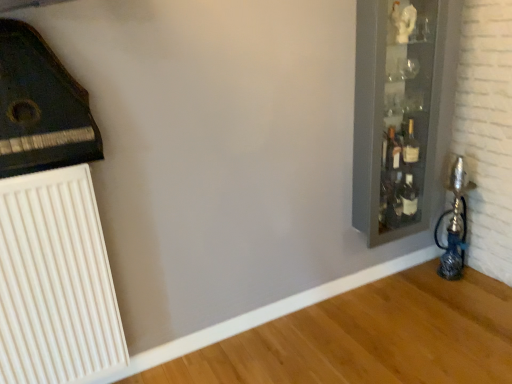
Measure the distance between point (389, 160) and camera.

The distance of point (389, 160) from camera is 6.98 feet.

The height and width of the screenshot is (384, 512). What do you see at coordinates (393, 151) in the screenshot? I see `translucent glass bottle at right` at bounding box center [393, 151].

The image size is (512, 384). I want to click on white plastic radiator at lower left, so pos(55,281).

Image resolution: width=512 pixels, height=384 pixels. What are the coordinates of `bottle below the clear glass cabinet at right (from the image's perspective)` in the screenshot? It's located at (393, 151).

Can you confirm if clear glass cabinet at right is taller than translucent glass bottle at right?

Yes.

From the image's perspective, between clear glass cabinet at right and translucent glass bottle at right, who is located below?

translucent glass bottle at right.

Would you say translucent glass bottle at right contains clear glass cabinet at right?

No, translucent glass bottle at right does not contain clear glass cabinet at right.

Between translucent glass bottle at right and clear glass cabinet at right, which one has larger size?

clear glass cabinet at right.

From the image's perspective, is translucent glass bottle at right located above or below clear glass cabinet at right?

translucent glass bottle at right is below clear glass cabinet at right.

Which object is further away from the camera taking this photo, translucent glass bottle at right or clear glass cabinet at right?

A: Positioned behind is translucent glass bottle at right.

Identify the location of radiator below the clear glass cabinet at right (from the image's perspective). tap(55, 281).

From a real-world perspective, who is located lower, clear glass cabinet at right or white plastic radiator at lower left?

From a 3D spatial view, white plastic radiator at lower left is below.

Which object is positioned more to the left, clear glass cabinet at right or white plastic radiator at lower left?

white plastic radiator at lower left.

Can you tell me how much clear glass cabinet at right and white plastic radiator at lower left differ in facing direction?

clear glass cabinet at right and white plastic radiator at lower left are facing 1.65 degrees away from each other.

Looking at this image, considering their positions, is white plastic radiator at lower left located in front of or behind clear glass cabinet at right?

white plastic radiator at lower left is positioned closer to the viewer than clear glass cabinet at right.

Which is more to the left, white plastic radiator at lower left or clear glass cabinet at right?

white plastic radiator at lower left is more to the left.

How many degrees apart are the facing directions of white plastic radiator at lower left and clear glass cabinet at right?

The angular difference between white plastic radiator at lower left and clear glass cabinet at right is 1.65 degrees.

In the scene shown: Would you say white plastic radiator at lower left is inside or outside clear glass cabinet at right?

The correct answer is: outside.

Which is closer, (25, 279) or (397, 144)?

Positioned in front is point (25, 279).

Can you tell me how much white plastic radiator at lower left and translucent glass bottle at right differ in facing direction?

The angle between the facing direction of white plastic radiator at lower left and the facing direction of translucent glass bottle at right is 1.65 degrees.

Is white plastic radiator at lower left oriented away from translucent glass bottle at right?

No, white plastic radiator at lower left's orientation is not away from translucent glass bottle at right.

Are white plastic radiator at lower left and translucent glass bottle at right located far from each other?

white plastic radiator at lower left is positioned a significant distance from translucent glass bottle at right.

Are translucent glass bottle at right and white plastic radiator at lower left beside each other?

translucent glass bottle at right and white plastic radiator at lower left are not in contact.

In terms of size, does translucent glass bottle at right appear bigger or smaller than white plastic radiator at lower left?

Clearly, translucent glass bottle at right is smaller in size than white plastic radiator at lower left.

From the image's perspective, is translucent glass bottle at right above or below white plastic radiator at lower left?

From the image's perspective, translucent glass bottle at right appears above white plastic radiator at lower left.

How different are the orientations of translucent glass bottle at right and white plastic radiator at lower left in degrees?

translucent glass bottle at right and white plastic radiator at lower left are facing 1.65 degrees away from each other.

The height and width of the screenshot is (384, 512). Identify the location of glass door in front of the translucent glass bottle at right. (402, 111).

In the image, there is a clear glass cabinet at right. Identify the location of bottle below it (from the image's perspective). Image resolution: width=512 pixels, height=384 pixels. (393, 151).

Looking at the image, which one is located closer to clear glass cabinet at right, translucent glass bottle at right or white plastic radiator at lower left?

translucent glass bottle at right is closer to clear glass cabinet at right.

Based on their spatial positions, is clear glass cabinet at right or translucent glass bottle at right further from white plastic radiator at lower left?

translucent glass bottle at right is further to white plastic radiator at lower left.

Considering their positions, is clear glass cabinet at right positioned further to translucent glass bottle at right than white plastic radiator at lower left?

Among the two, white plastic radiator at lower left is located further to translucent glass bottle at right.

Estimate the real-world distances between objects in this image. Which object is closer to white plastic radiator at lower left, translucent glass bottle at right or clear glass cabinet at right?

clear glass cabinet at right is positioned closer to the anchor white plastic radiator at lower left.

Looking at the image, which one is located closer to translucent glass bottle at right, white plastic radiator at lower left or clear glass cabinet at right?

clear glass cabinet at right.

From the image, which object appears to be farther from clear glass cabinet at right, white plastic radiator at lower left or translucent glass bottle at right?

white plastic radiator at lower left is further to clear glass cabinet at right.

Image resolution: width=512 pixels, height=384 pixels. Find the location of `glass door between white plastic radiator at lower left and translucent glass bottle at right in the horizontal direction`. glass door between white plastic radiator at lower left and translucent glass bottle at right in the horizontal direction is located at coordinates (402, 111).